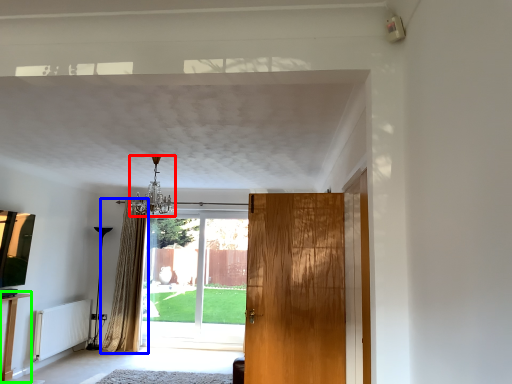
Question: Considering the real-world distances, which object is closest to light fixture (highlighted by a red box)? curtain (highlighted by a blue box) or table (highlighted by a green box).

Choices:
 (A) curtain
 (B) table

Answer: (A)